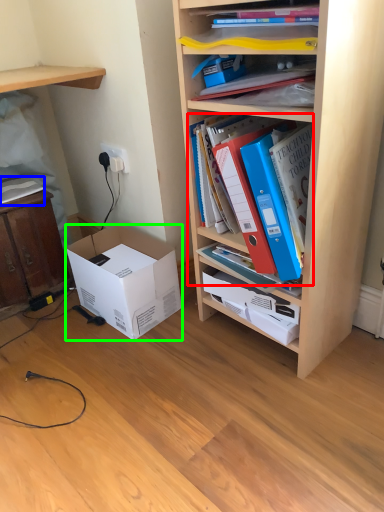
Question: Estimate the real-world distances between objects in this image. Which object is farther from book (highlighted by a red box), book (highlighted by a blue box) or box (highlighted by a green box)?

Choices:
 (A) book
 (B) box

Answer: (A)